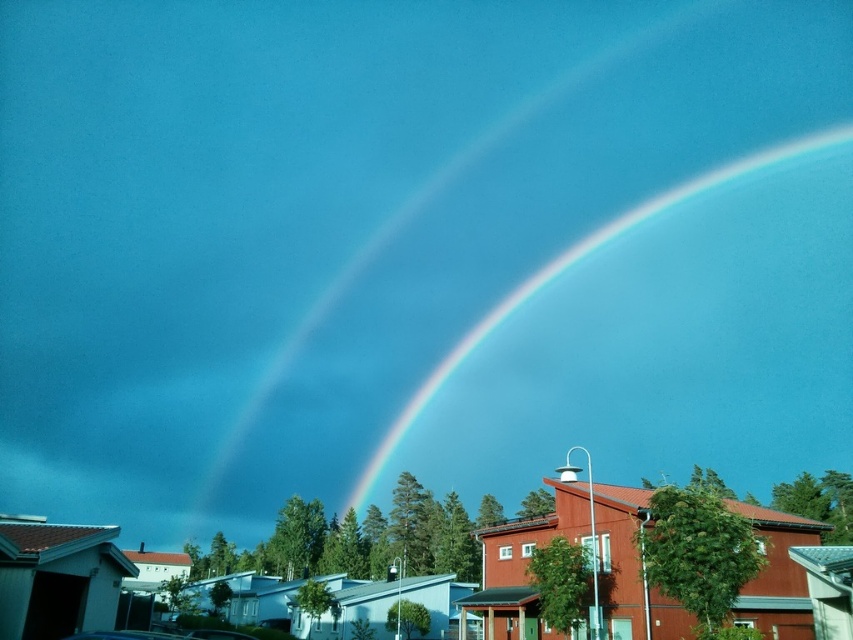
Question: Does rainbow at upper center lie behind metallic silver car at lower center?

Choices:
 (A) yes
 (B) no

Answer: (A)

Question: Which point is closer to the camera?

Choices:
 (A) metallic silver car at lower center
 (B) rainbow at upper center

Answer: (A)

Question: In this image, where is rainbow at upper center located relative to metallic silver car at lower center?

Choices:
 (A) left
 (B) right

Answer: (B)

Question: Observing the image, what is the correct spatial positioning of rainbow at upper center in reference to metallic silver car at lower center?

Choices:
 (A) right
 (B) left

Answer: (A)